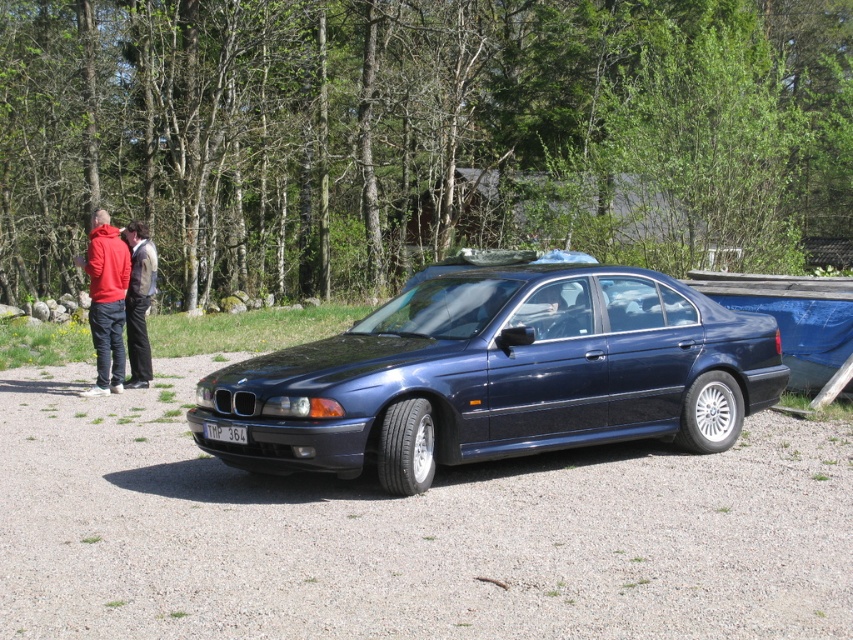
Question: Which point is farther to the camera?

Choices:
 (A) (114, 305)
 (B) (229, 426)

Answer: (A)

Question: Which point appears farthest from the camera in this image?

Choices:
 (A) (140, 228)
 (B) (631, 358)
 (C) (235, 436)
 (D) (119, 304)

Answer: (A)

Question: Does dark blue leather jacket at left have a smaller size compared to white plastic license plate at center?

Choices:
 (A) no
 (B) yes

Answer: (A)

Question: Does glossy metallic car at center appear on the right side of white plastic license plate at center?

Choices:
 (A) yes
 (B) no

Answer: (A)

Question: Is matte red hoodie at left further to the viewer compared to white plastic license plate at center?

Choices:
 (A) no
 (B) yes

Answer: (B)

Question: Which of the following is the closest to the observer?

Choices:
 (A) (138, 371)
 (B) (602, 422)

Answer: (B)